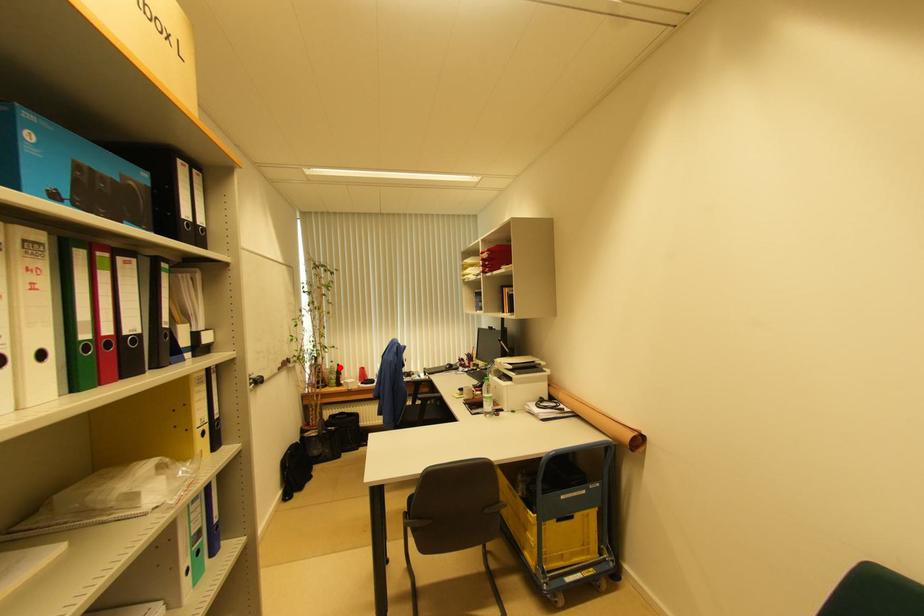
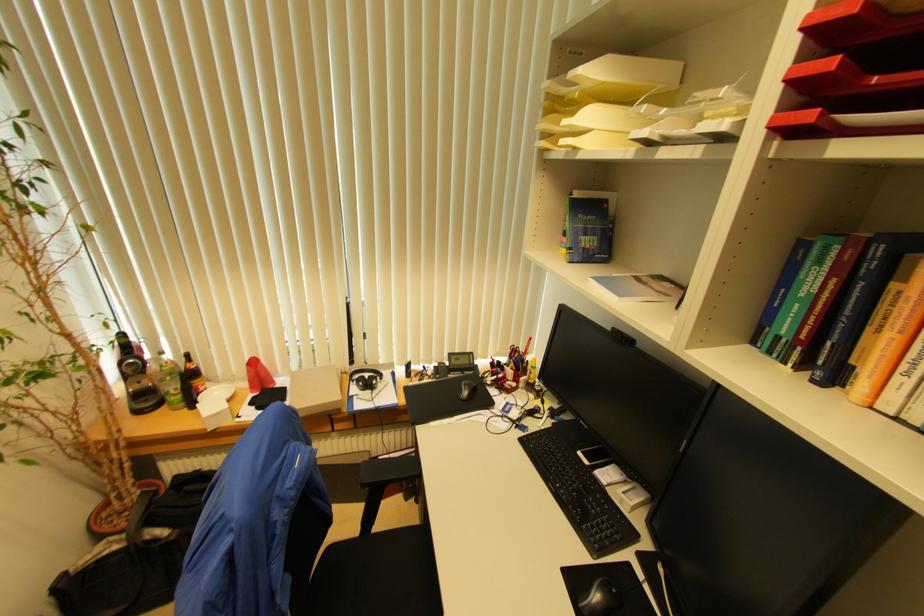
Question: I am providing you with two images of the same scene from different viewpoints. A red point is shown in image1. For the corresponding object point in image2, is it positioned nearer or farther from the camera?

Choices:
 (A) Nearer
 (B) Farther

Answer: (A)